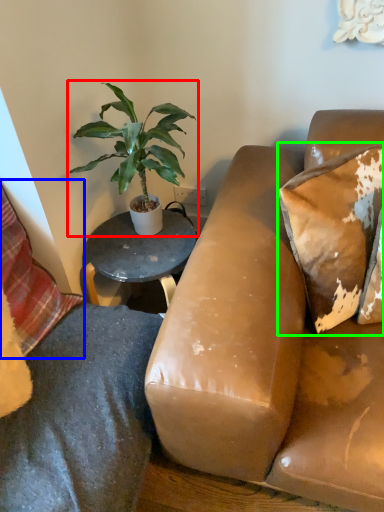
Question: Considering the real-world distances, which object is closest to houseplant (highlighted by a red box)? pillow (highlighted by a blue box) or pillow (highlighted by a green box).

Choices:
 (A) pillow
 (B) pillow

Answer: (A)